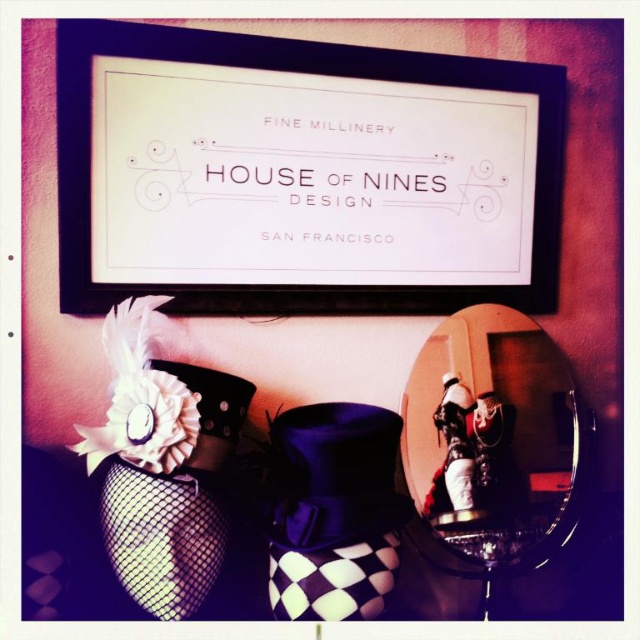
Does black matte picture frame at upper center lie in front of white fabric flower at lower left?

No, black matte picture frame at upper center is further to the viewer.

Where is `black matte picture frame at upper center`? This screenshot has width=640, height=640. black matte picture frame at upper center is located at coordinates (301, 173).

Locate an element on the screen. This screenshot has height=640, width=640. black matte picture frame at upper center is located at coordinates (301, 173).